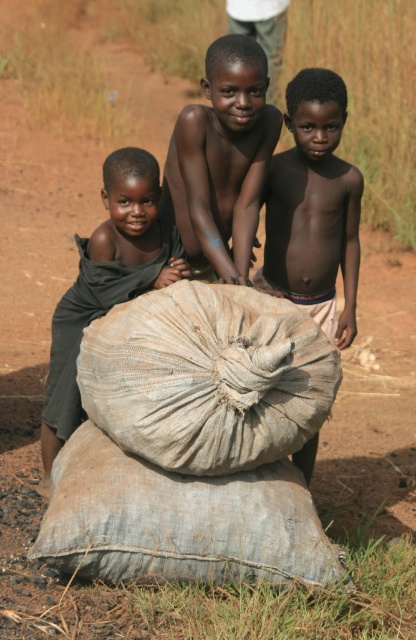
Which is more to the right, brown matte boy at center or dark green fabric at left?

From the viewer's perspective, brown matte boy at center appears more on the right side.

Who is more forward, (170, 209) or (183, 256)?

Point (183, 256)

Where is `brown matte boy at center`? brown matte boy at center is located at coordinates (222, 161).

This screenshot has height=640, width=416. I want to click on smooth skin boy at center, so click(314, 208).

Which is behind, point (337, 77) or point (114, 214)?

Positioned behind is point (337, 77).

Identify the location of smooth skin boy at center. This screenshot has height=640, width=416. (314, 208).

You are a GUI agent. You are given a task and a screenshot of the screen. Output one action in this format:
    pyautogui.click(x=<x>, y=<y>)
    Task: Click on the smooth skin boy at center
    The height and width of the screenshot is (640, 416).
    Given the screenshot: What is the action you would take?
    pyautogui.click(x=314, y=208)

Can you confirm if smooth skin boy at center is wider than brown matte boy at center?

No, smooth skin boy at center is not wider than brown matte boy at center.

Who is taller, smooth skin boy at center or brown matte boy at center?

smooth skin boy at center

Locate an element on the screen. Image resolution: width=416 pixels, height=640 pixels. smooth skin boy at center is located at coordinates (314, 208).